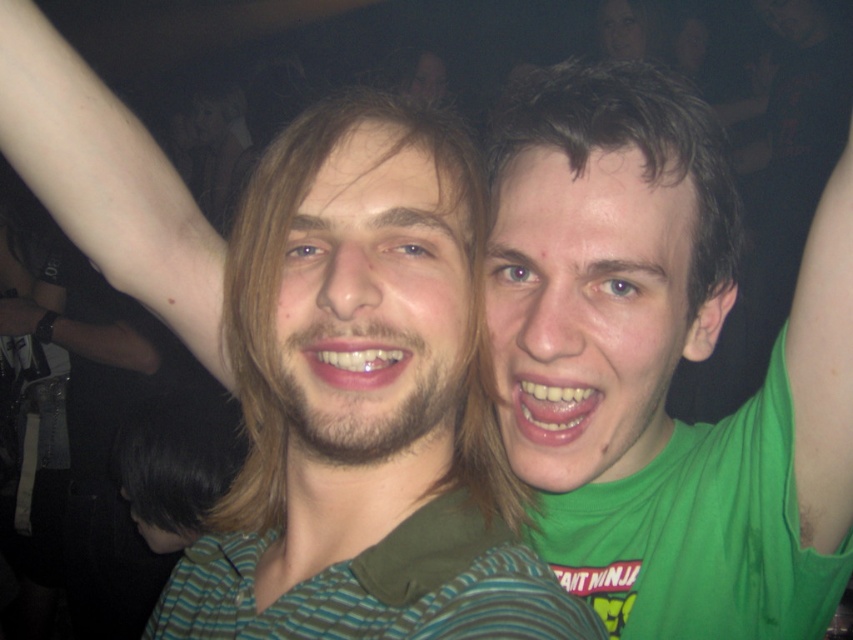
Question: Does green matte shirt at center have a larger size compared to smooth skin face at upper right?

Choices:
 (A) no
 (B) yes

Answer: (B)

Question: Among these objects, which one is nearest to the camera?

Choices:
 (A) smooth skin face at upper right
 (B) green matte tank top at right

Answer: (B)

Question: Can you confirm if green matte shirt at center is positioned above green matte tank top at right?

Choices:
 (A) no
 (B) yes

Answer: (B)

Question: Among these objects, which one is farthest from the camera?

Choices:
 (A) green matte tank top at right
 (B) smooth skin face at upper right

Answer: (B)

Question: Can you confirm if green matte tank top at right is smaller than smooth skin face at upper right?

Choices:
 (A) no
 (B) yes

Answer: (A)

Question: Which object is positioned farthest from the green matte tank top at right?

Choices:
 (A) smooth skin face at upper right
 (B) green matte shirt at center

Answer: (A)